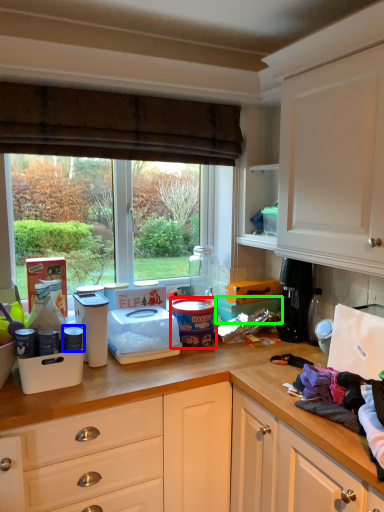
Question: Which is farther away from appliance (highlighted by a red box)? appliance (highlighted by a blue box) or box (highlighted by a green box)?

Choices:
 (A) appliance
 (B) box

Answer: (A)